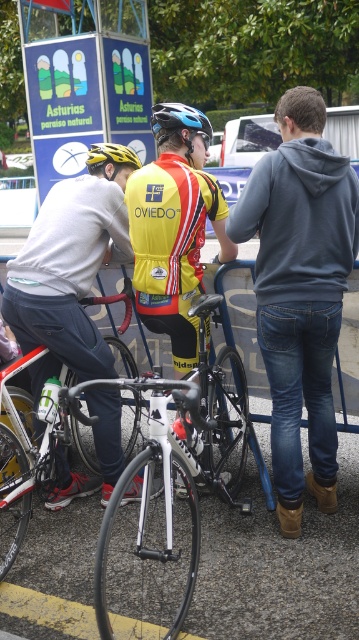
Which is above, yellow fabric safety vest at center or matte blue bicycle helmet at center?

matte blue bicycle helmet at center is higher up.

What do you see at coordinates (170, 225) in the screenshot? I see `yellow fabric safety vest at center` at bounding box center [170, 225].

Locate an element on the screen. yellow fabric safety vest at center is located at coordinates (170, 225).

Who is positioned more to the right, denim jeans at center or yellow/red jersey at center?

From the viewer's perspective, denim jeans at center appears more on the right side.

Image resolution: width=359 pixels, height=640 pixels. I want to click on denim jeans at center, so click(x=300, y=291).

Who is lower down, white glossy bicycle at center or yellow/red jersey at center?

Positioned lower is white glossy bicycle at center.

Which is more to the right, white glossy bicycle at center or yellow/red jersey at center?

Positioned to the right is white glossy bicycle at center.

What do you see at coordinates (169, 499) in the screenshot? I see `white glossy bicycle at center` at bounding box center [169, 499].

Where is `white glossy bicycle at center`? This screenshot has width=359, height=640. white glossy bicycle at center is located at coordinates (169, 499).